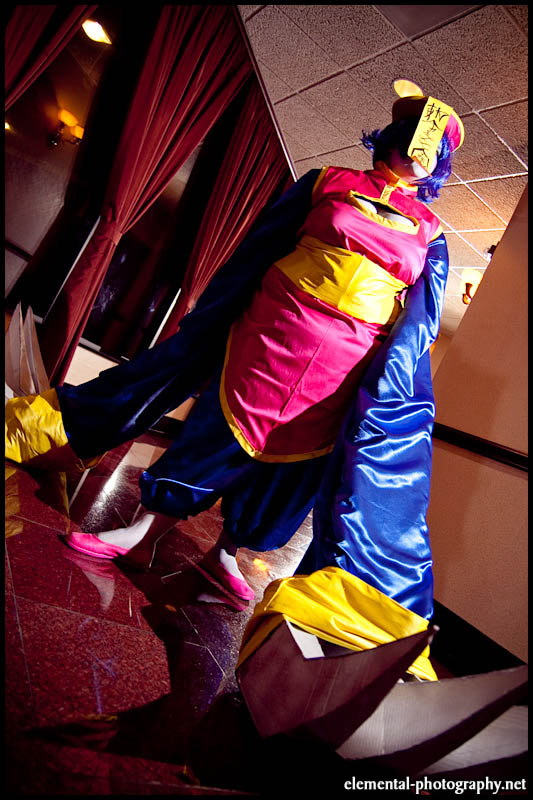
Where is `floor`? This screenshot has width=533, height=800. floor is located at coordinates 115,658.